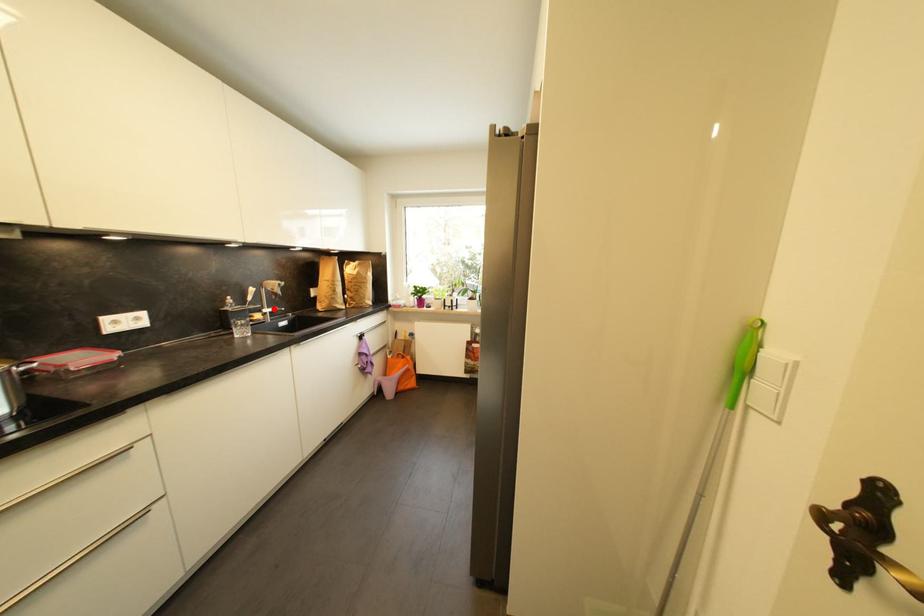
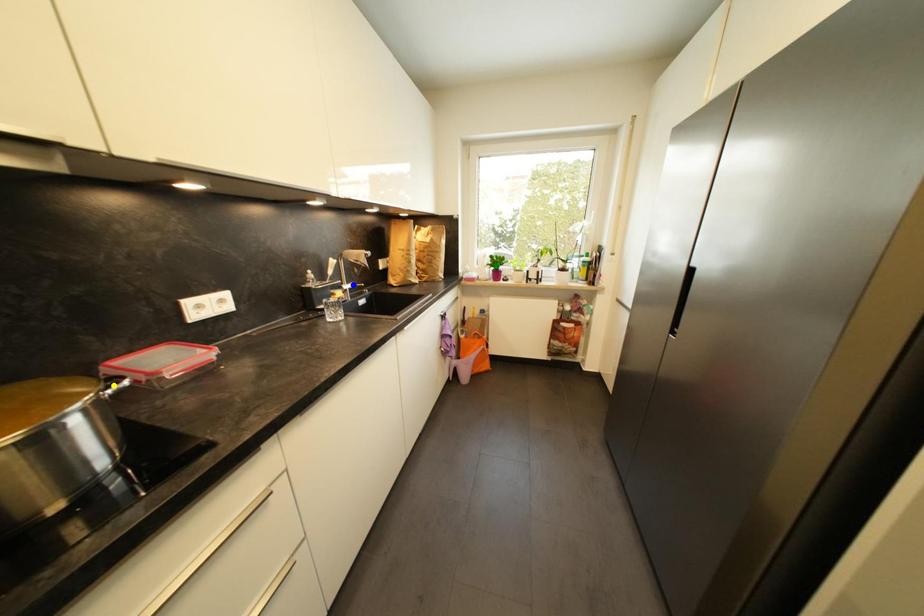
Question: I am providing you with two images of the same scene from different viewpoints. A red point is marked on the first image. You are given multiple points on the second image. Which spot in image 2 lines up with the point in image 1?

Choices:
 (A) yellow point
 (B) green point
 (C) blue point

Answer: (C)